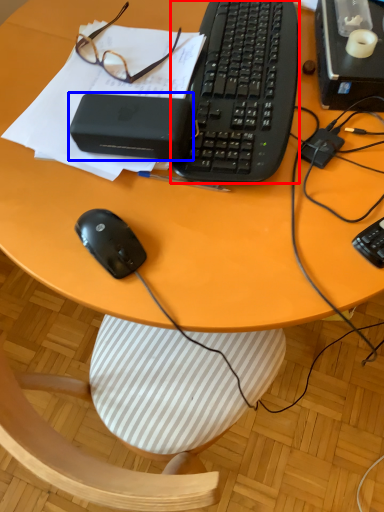
Question: Which point is closer to the camera, computer keyboard (highlighted by a red box) or gadget (highlighted by a blue box)?

Choices:
 (A) computer keyboard
 (B) gadget

Answer: (B)